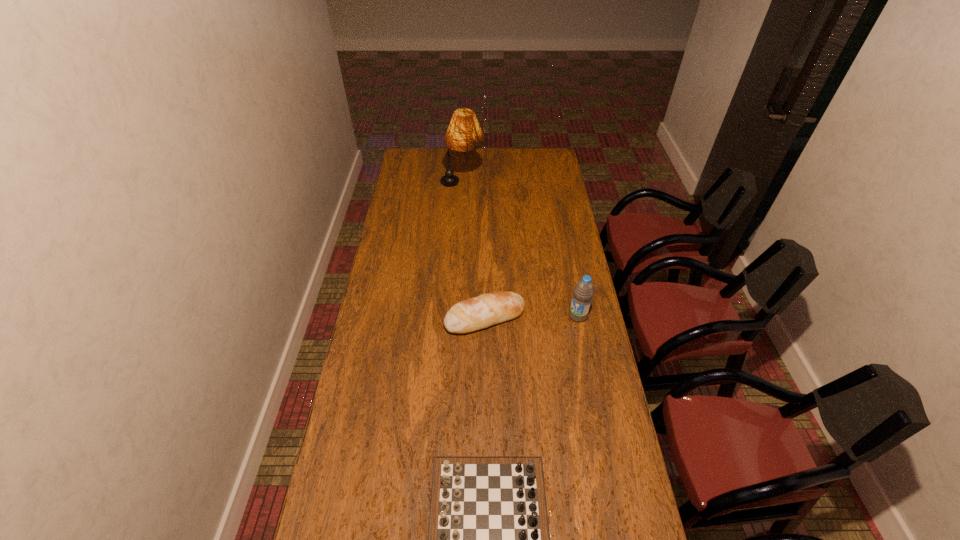
The height and width of the screenshot is (540, 960). I want to click on unoccupied position between the second shortest object and the second tallest object, so click(531, 316).

What are the coordinates of `object that is the third nearest to the shortest object` in the screenshot? It's located at (464, 133).

Identify the location of object that ranks as the second closest to the rightmost object. This screenshot has height=540, width=960. (488, 538).

This screenshot has height=540, width=960. In order to click on free space that satisfies the following two spatial constraints: 1. on the front-facing side of the farthest object; 2. on the right side of the rightmost object in this screenshot , I will do `click(456, 316)`.

Find the location of a particular element. vacant space that satisfies the following two spatial constraints: 1. on the front-facing side of the lampshade; 2. on the left side of the third tallest object is located at coordinates (456, 318).

Locate an element on the screen. The image size is (960, 540). free spot that satisfies the following two spatial constraints: 1. on the front-facing side of the tallest object; 2. on the left side of the third shortest object is located at coordinates (456, 316).

Identify the location of free space that satisfies the following two spatial constraints: 1. on the front-facing side of the third tallest object; 2. on the right side of the lampshade. (456, 318).